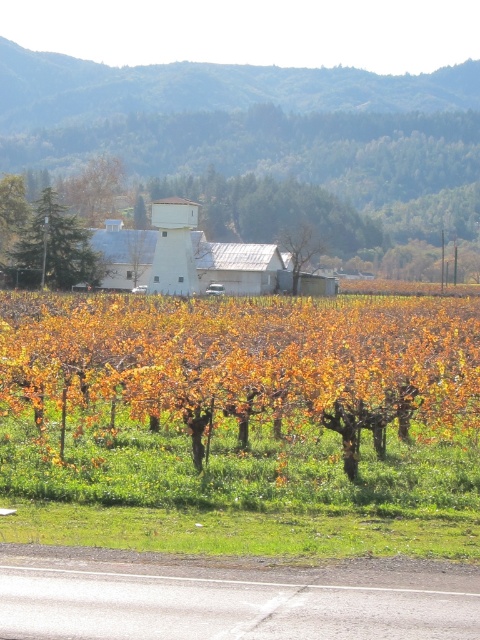
Between point (75, 244) and point (80, 214), which one is positioned in front?

Positioned in front is point (75, 244).

Between point (13, 244) and point (73, 180), which one is positioned behind?

The point (73, 180) is behind.

At what (x,y) coordinates should I click in order to perform the action: click on green textured pine tree at upper left. Please return your answer as a coordinate pair (x, y). This screenshot has width=480, height=640. Looking at the image, I should click on 57,244.

Between point (425, 349) and point (48, 237), which one is positioned in front?

Point (425, 349) is in front.

Between point (39, 396) and point (72, 278), which one is positioned in front?

Positioned in front is point (39, 396).

Locate an element on the screen. yellow-green leafy vines at center is located at coordinates (242, 365).

Does green leafy tree at upper center have a greater height compared to green leafy tree at center?

Indeed, green leafy tree at upper center has a greater height compared to green leafy tree at center.

Who is more forward, (111, 168) or (297, 237)?

Point (297, 237) is in front.

Where is `green leafy tree at upper center`? This screenshot has width=480, height=640. green leafy tree at upper center is located at coordinates (94, 188).